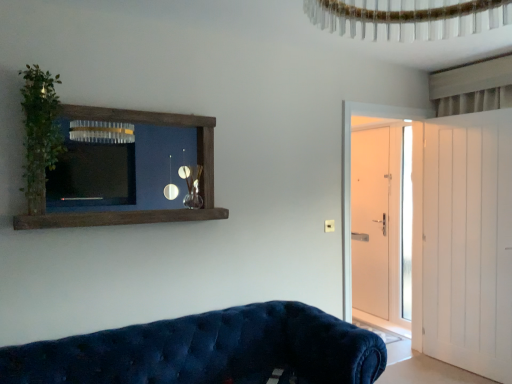
Question: Is brown wooden shelf at upper left wider than white wooden door at right, placed as the second door when sorted from back to front?

Choices:
 (A) yes
 (B) no

Answer: (B)

Question: Is brown wooden shelf at upper left closer to camera compared to white wooden door at right, placed as the second door when sorted from back to front?

Choices:
 (A) yes
 (B) no

Answer: (A)

Question: Can you confirm if brown wooden shelf at upper left is bigger than white wooden door at right, the 2th door from the front?

Choices:
 (A) no
 (B) yes

Answer: (A)

Question: Could you tell me if brown wooden shelf at upper left is facing white wooden door at right, the 2th door from the front?

Choices:
 (A) yes
 (B) no

Answer: (B)

Question: Can you confirm if brown wooden shelf at upper left is thinner than white wooden door at right, the 2th door from the front?

Choices:
 (A) no
 (B) yes

Answer: (B)

Question: From a real-world perspective, is white wooden door at right, the 2th door from the front, above or below white wooden door at right, arranged as the 3th door when viewed from the back?

Choices:
 (A) above
 (B) below

Answer: (A)

Question: From their relative heights in the image, would you say white wooden door at right, placed as the second door when sorted from back to front, is taller or shorter than white wooden door at right, arranged as the 3th door when viewed from the back?

Choices:
 (A) tall
 (B) short

Answer: (A)

Question: Is white wooden door at right, placed as the second door when sorted from back to front, wider or thinner than white wooden door at right, the first door positioned from the front?

Choices:
 (A) wide
 (B) thin

Answer: (A)

Question: From the image's perspective, is white wooden door at right, placed as the second door when sorted from back to front, above or below white wooden door at right, the first door positioned from the front?

Choices:
 (A) above
 (B) below

Answer: (A)

Question: Is green leafy plant at left in front of or behind velvet blue couch at lower left in the image?

Choices:
 (A) front
 (B) behind

Answer: (B)

Question: Is green leafy plant at left taller or shorter than velvet blue couch at lower left?

Choices:
 (A) short
 (B) tall

Answer: (B)

Question: Is green leafy plant at left bigger or smaller than velvet blue couch at lower left?

Choices:
 (A) big
 (B) small

Answer: (B)

Question: Is green leafy plant at left situated inside velvet blue couch at lower left or outside?

Choices:
 (A) outside
 (B) inside

Answer: (A)

Question: Is point (155, 117) closer or farther from the camera than point (348, 233)?

Choices:
 (A) farther
 (B) closer

Answer: (B)

Question: In terms of size, does brown wooden shelf at upper left appear bigger or smaller than white wooden door at right, the 2th door from the front?

Choices:
 (A) big
 (B) small

Answer: (B)